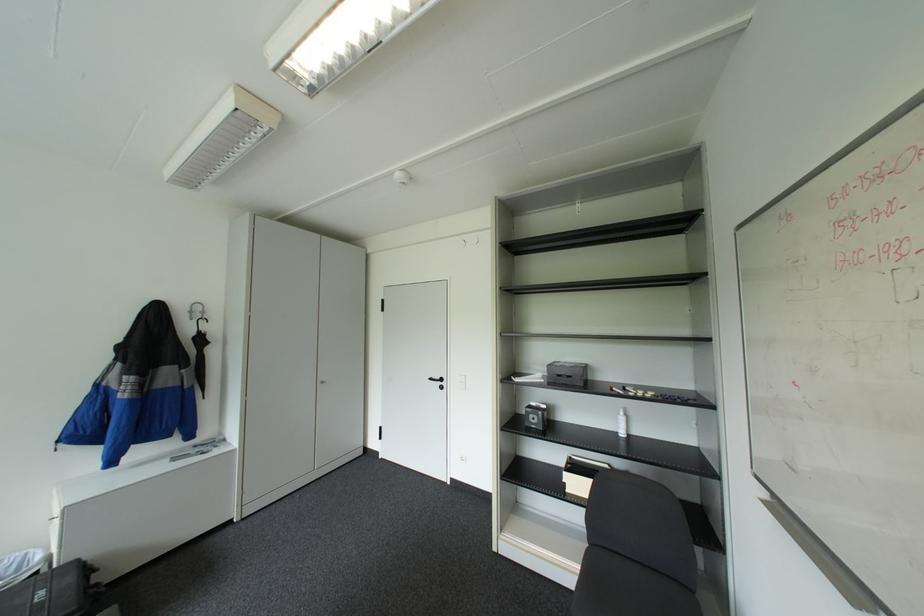
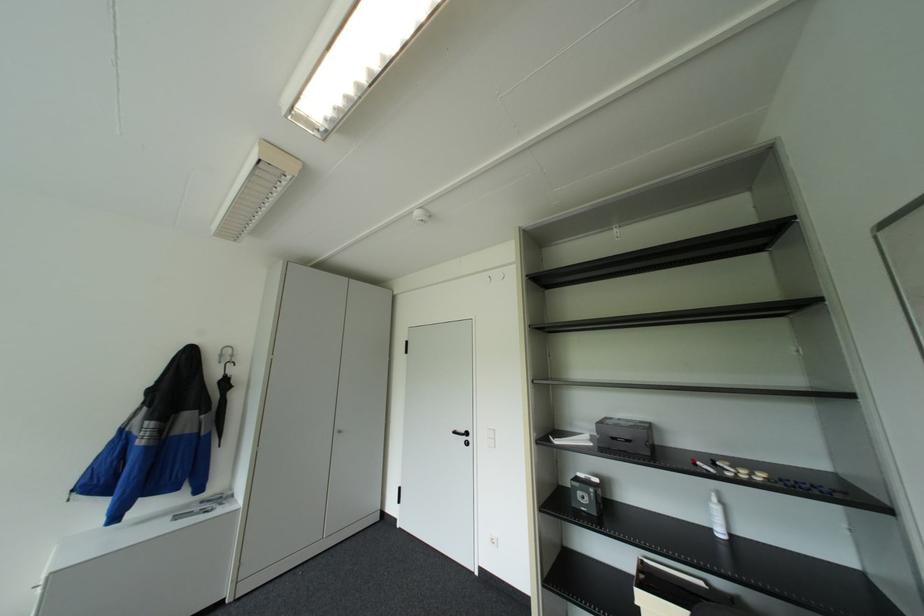
Locate, in the second image, the point that corresponds to (200,318) in the first image.

(227, 361)